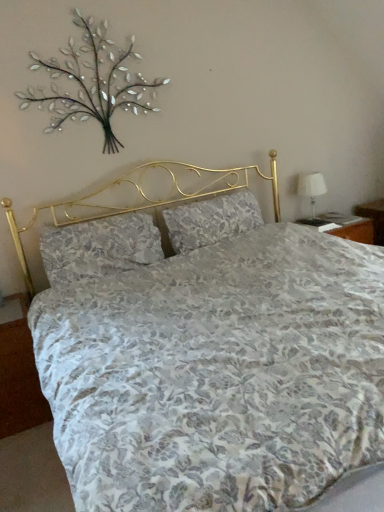
Describe the element at coordinates (311, 193) in the screenshot. This screenshot has height=512, width=384. I see `white fabric lampshade at right` at that location.

What do you see at coordinates (92, 83) in the screenshot? I see `metallic silver branches at upper left` at bounding box center [92, 83].

At what (x,y) coordinates should I click in order to perform the action: click on floral fabric pillow at center, which is counted as the 2th pillow, starting from the left. Please return your answer as a coordinate pair (x, y). The height and width of the screenshot is (512, 384). Looking at the image, I should click on (211, 220).

You are a GUI agent. You are given a task and a screenshot of the screen. Output one action in this format:
    pyautogui.click(x=<x>, y=<y>)
    Task: Click on the white fabric lampshade at right
    This screenshot has height=512, width=384.
    Given the screenshot: What is the action you would take?
    pyautogui.click(x=311, y=193)

Considering the sizes of metallic silver branches at upper left and floral fabric pillow at center, positioned as the 2th pillow in right-to-left order, in the image, is metallic silver branches at upper left wider or thinner than floral fabric pillow at center, positioned as the 2th pillow in right-to-left order,?

Considering their sizes, metallic silver branches at upper left looks slimmer than floral fabric pillow at center, positioned as the 2th pillow in right-to-left order.

From the image's perspective, does metallic silver branches at upper left appear lower than floral fabric pillow at center, positioned as the 2th pillow in right-to-left order?

Incorrect, from the image's perspective, metallic silver branches at upper left is higher than floral fabric pillow at center, positioned as the 2th pillow in right-to-left order.

Would you say metallic silver branches at upper left is to the left or to the right of floral fabric pillow at center, which ranks as the 1th pillow in left-to-right order, in the picture?

From the image, it's evident that metallic silver branches at upper left is to the left of floral fabric pillow at center, which ranks as the 1th pillow in left-to-right order.

Consider the image. Is floral fabric pillow at center, positioned as the 2th pillow in right-to-left order, surrounded by floral fabric pillow at center, which is counted as the 2th pillow, starting from the left?

No, floral fabric pillow at center, positioned as the 2th pillow in right-to-left order, is not a part of floral fabric pillow at center, which is counted as the 2th pillow, starting from the left.

In the image, there is a floral fabric pillow at center, positioned as the 1th pillow in right-to-left order. Where is `pillow below it (from the image's perspective)`? This screenshot has height=512, width=384. pillow below it (from the image's perspective) is located at coordinates (99, 247).

How different are the orientations of floral fabric pillow at center, positioned as the 1th pillow in right-to-left order, and floral fabric pillow at center, which ranks as the 1th pillow in left-to-right order, in degrees?

The facing directions of floral fabric pillow at center, positioned as the 1th pillow in right-to-left order, and floral fabric pillow at center, which ranks as the 1th pillow in left-to-right order, are 0.000232 degrees apart.

Considering the relative sizes of floral fabric pillow at center, positioned as the 1th pillow in right-to-left order, and floral fabric pillow at center, positioned as the 2th pillow in right-to-left order, in the image provided, is floral fabric pillow at center, positioned as the 1th pillow in right-to-left order, smaller than floral fabric pillow at center, positioned as the 2th pillow in right-to-left order,?

Correct, floral fabric pillow at center, positioned as the 1th pillow in right-to-left order, occupies less space than floral fabric pillow at center, positioned as the 2th pillow in right-to-left order.

Is point (42, 98) in front of point (312, 198)?

That is True.

From a real-world perspective, between metallic silver branches at upper left and white fabric lampshade at right, who is vertically lower?

white fabric lampshade at right.

Can we say metallic silver branches at upper left lies outside white fabric lampshade at right?

Absolutely, metallic silver branches at upper left is external to white fabric lampshade at right.

How many degrees apart are the facing directions of metallic silver branches at upper left and white fabric lampshade at right?

metallic silver branches at upper left and white fabric lampshade at right are facing 0.736 degrees away from each other.

Is metallic silver branches at upper left taller than floral fabric pillow at center, which is counted as the 2th pillow, starting from the left?

Correct, metallic silver branches at upper left is much taller as floral fabric pillow at center, which is counted as the 2th pillow, starting from the left.

Is metallic silver branches at upper left oriented towards floral fabric pillow at center, positioned as the 1th pillow in right-to-left order?

No, metallic silver branches at upper left is not aimed at floral fabric pillow at center, positioned as the 1th pillow in right-to-left order.

Is floral fabric pillow at center, positioned as the 1th pillow in right-to-left order, a part of metallic silver branches at upper left?

No, floral fabric pillow at center, positioned as the 1th pillow in right-to-left order, is not inside metallic silver branches at upper left.

Does point (92, 103) come closer to viewer compared to point (182, 253)?

That is True.

I want to click on the 1st pillow behind the metallic silver branches at upper left, so [99, 247].

From the image's perspective, between floral fabric pillow at center, positioned as the 2th pillow in right-to-left order, and metallic silver branches at upper left, who is located below?

floral fabric pillow at center, positioned as the 2th pillow in right-to-left order.

Relative to metallic silver branches at upper left, is floral fabric pillow at center, positioned as the 2th pillow in right-to-left order, in front or behind?

In the image, floral fabric pillow at center, positioned as the 2th pillow in right-to-left order, appears behind metallic silver branches at upper left.

From a real-world perspective, who is located higher, white fabric lampshade at right or floral fabric pillow at center, which ranks as the 1th pillow in left-to-right order?

In real-world perspective, floral fabric pillow at center, which ranks as the 1th pillow in left-to-right order, is above.

Is white fabric lampshade at right beside floral fabric pillow at center, which ranks as the 1th pillow in left-to-right order?

white fabric lampshade at right and floral fabric pillow at center, which ranks as the 1th pillow in left-to-right order, are not in contact.

Is white fabric lampshade at right thinner than floral fabric pillow at center, positioned as the 2th pillow in right-to-left order?

Yes, white fabric lampshade at right is thinner than floral fabric pillow at center, positioned as the 2th pillow in right-to-left order.

Which is more to the left, white fabric lampshade at right or floral fabric pillow at center, which ranks as the 1th pillow in left-to-right order?

Positioned to the left is floral fabric pillow at center, which ranks as the 1th pillow in left-to-right order.

Which object is thinner, floral fabric pillow at center, positioned as the 1th pillow in right-to-left order, or white fabric lampshade at right?

white fabric lampshade at right.

Considering the points (217, 241) and (313, 216), which point is behind, point (217, 241) or point (313, 216)?

The point (313, 216) is more distant.

This screenshot has width=384, height=512. Find the location of `table lamp on the right of floral fabric pillow at center, which is counted as the 2th pillow, starting from the left`. table lamp on the right of floral fabric pillow at center, which is counted as the 2th pillow, starting from the left is located at coordinates (311, 193).

Identify the location of floral arrangement above the floral fabric pillow at center, positioned as the 2th pillow in right-to-left order (from the image's perspective). This screenshot has width=384, height=512. (92, 83).

Find the location of a particular element. pillow located on the left of floral fabric pillow at center, positioned as the 1th pillow in right-to-left order is located at coordinates (99, 247).

Considering their positions, is white fabric lampshade at right positioned further to floral fabric pillow at center, which is counted as the 2th pillow, starting from the left, than metallic silver branches at upper left?

Among the two, metallic silver branches at upper left is located further to floral fabric pillow at center, which is counted as the 2th pillow, starting from the left.

Considering their positions, is floral fabric pillow at center, positioned as the 1th pillow in right-to-left order, positioned closer to floral fabric pillow at center, positioned as the 2th pillow in right-to-left order, than metallic silver branches at upper left?

floral fabric pillow at center, positioned as the 1th pillow in right-to-left order.

Based on their spatial positions, is white fabric lampshade at right or metallic silver branches at upper left further from floral fabric pillow at center, which ranks as the 1th pillow in left-to-right order?

white fabric lampshade at right lies further to floral fabric pillow at center, which ranks as the 1th pillow in left-to-right order, than the other object.

Which object lies nearer to the anchor point floral fabric pillow at center, positioned as the 1th pillow in right-to-left order, floral fabric pillow at center, which ranks as the 1th pillow in left-to-right order, or white fabric lampshade at right?

floral fabric pillow at center, which ranks as the 1th pillow in left-to-right order, lies closer to floral fabric pillow at center, positioned as the 1th pillow in right-to-left order, than the other object.

From the image, which object appears to be farther from floral fabric pillow at center, which is counted as the 2th pillow, starting from the left, metallic silver branches at upper left or floral fabric pillow at center, positioned as the 2th pillow in right-to-left order?

metallic silver branches at upper left lies further to floral fabric pillow at center, which is counted as the 2th pillow, starting from the left, than the other object.

Considering their positions, is white fabric lampshade at right positioned further to floral fabric pillow at center, positioned as the 1th pillow in right-to-left order, than floral fabric pillow at center, positioned as the 2th pillow in right-to-left order?

white fabric lampshade at right is further to floral fabric pillow at center, positioned as the 1th pillow in right-to-left order.

From the picture: From the image, which object appears to be nearer to white fabric lampshade at right, floral fabric pillow at center, positioned as the 1th pillow in right-to-left order, or metallic silver branches at upper left?

floral fabric pillow at center, positioned as the 1th pillow in right-to-left order.

Estimate the real-world distances between objects in this image. Which object is closer to white fabric lampshade at right, metallic silver branches at upper left or floral fabric pillow at center, positioned as the 1th pillow in right-to-left order?

Among the two, floral fabric pillow at center, positioned as the 1th pillow in right-to-left order, is located nearer to white fabric lampshade at right.

Where is `pillow between metallic silver branches at upper left and floral fabric pillow at center, which ranks as the 1th pillow in left-to-right order, from top to bottom`? The image size is (384, 512). pillow between metallic silver branches at upper left and floral fabric pillow at center, which ranks as the 1th pillow in left-to-right order, from top to bottom is located at coordinates (211, 220).

At what (x,y) coordinates should I click in order to perform the action: click on pillow situated between floral fabric pillow at center, positioned as the 2th pillow in right-to-left order, and white fabric lampshade at right from left to right. Please return your answer as a coordinate pair (x, y). Image resolution: width=384 pixels, height=512 pixels. Looking at the image, I should click on (211, 220).